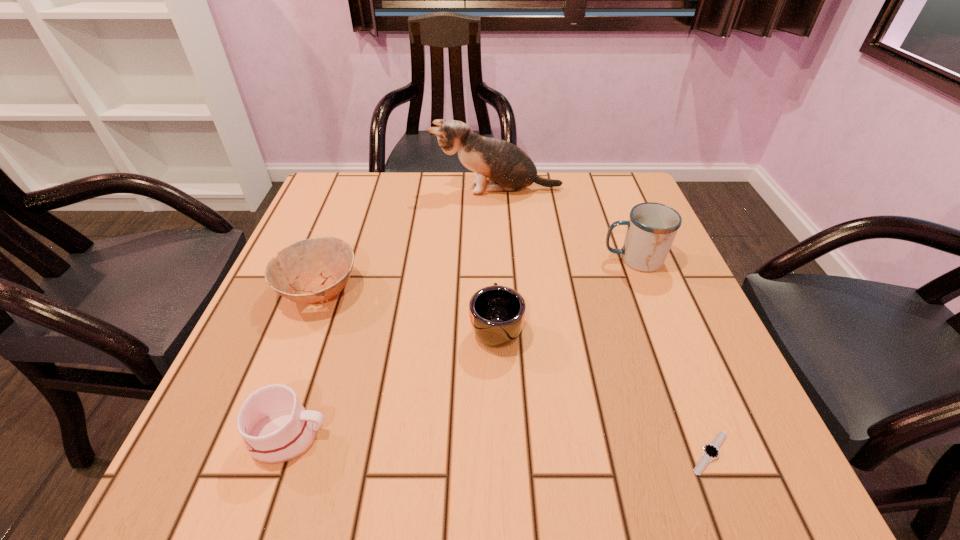
Find the location of a particular element. This screenshot has width=960, height=540. vacant space at the near edge is located at coordinates (646, 485).

The height and width of the screenshot is (540, 960). I want to click on vacant space at the left edge of the desktop, so click(307, 225).

Identify the location of blank space at the right edge of the desktop. This screenshot has height=540, width=960. (737, 395).

You are a GUI agent. You are given a task and a screenshot of the screen. Output one action in this format:
    pyautogui.click(x=<x>, y=<y>)
    Task: Click on the free region at the far left corner of the desktop
    
    Given the screenshot: What is the action you would take?
    pyautogui.click(x=351, y=221)

In the image, there is a desktop. Identify the location of free space at the far right corner. (633, 173).

Locate an element on the screen. The height and width of the screenshot is (540, 960). free space that is in between the leftmost mug and the bowl is located at coordinates (303, 363).

The width and height of the screenshot is (960, 540). Find the location of `empty space that is in between the second mug from right to left and the nearest mug`. empty space that is in between the second mug from right to left and the nearest mug is located at coordinates (392, 381).

The height and width of the screenshot is (540, 960). Identify the location of vacant space that is in between the second nearest mug and the nearest mug. (392, 381).

Find the location of a particular element. Image resolution: width=960 pixels, height=540 pixels. free spot between the bowl and the second mug from right to left is located at coordinates (408, 308).

Where is `vacant space in between the second nearest mug and the shortest object`? Image resolution: width=960 pixels, height=540 pixels. vacant space in between the second nearest mug and the shortest object is located at coordinates (603, 390).